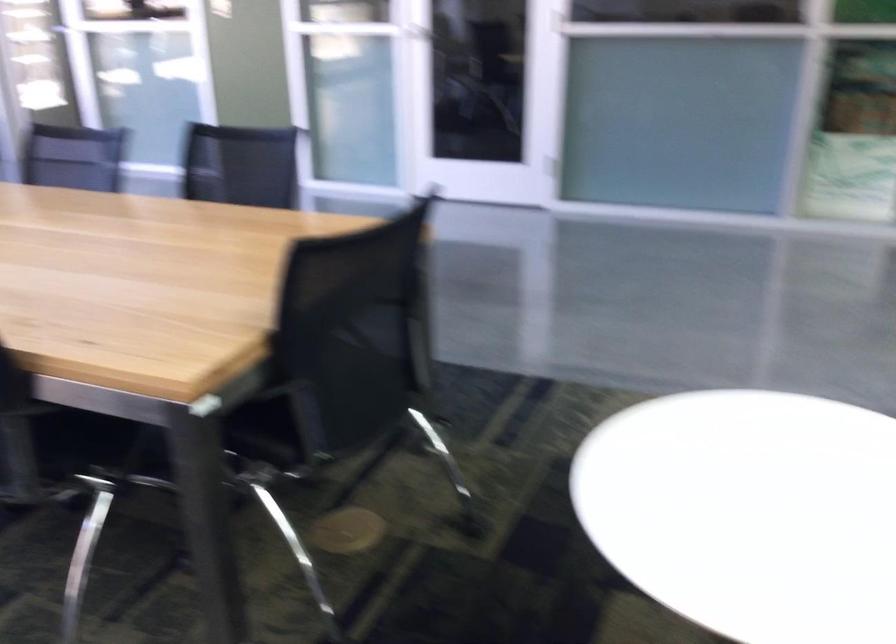
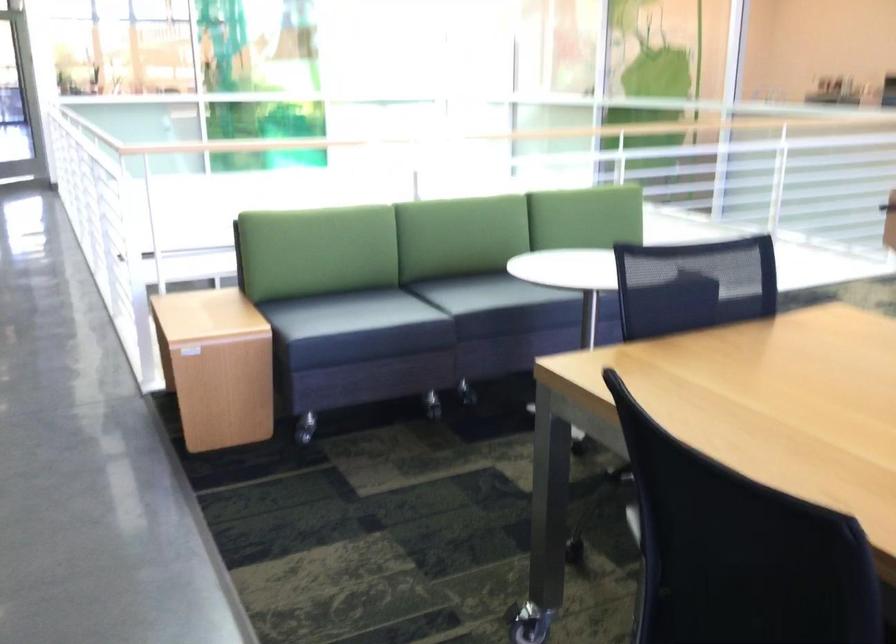
In the second image, find the point that corresponds to (312,283) in the first image.

(695, 275)